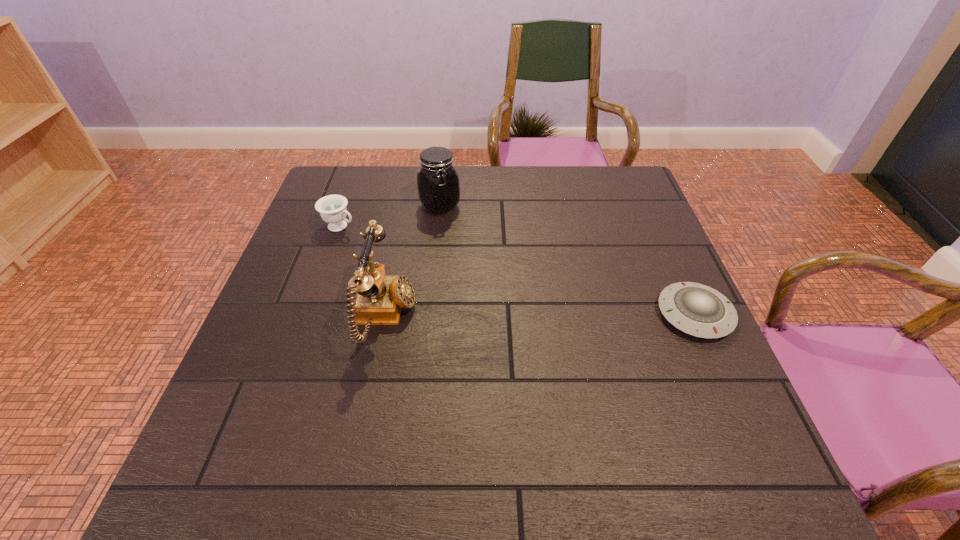
Find the location of a particular element. This screenshot has width=960, height=540. free spot between the jar and the rightmost object is located at coordinates (567, 260).

Locate an element on the screen. vacant space that's between the telephone and the jar is located at coordinates (413, 261).

Find the location of a particular element. This screenshot has width=960, height=540. vacant space that is in between the rightmost object and the leftmost object is located at coordinates (517, 270).

Where is `object that is the second nearest to the telephone`? object that is the second nearest to the telephone is located at coordinates (438, 185).

The image size is (960, 540). In order to click on object that stands as the second closest to the telephone in this screenshot , I will do `click(438, 185)`.

In order to click on free space that satisfies the following two spatial constraints: 1. on the front side of the teacup; 2. on the right side of the rightmost object in this screenshot , I will do `click(309, 314)`.

The height and width of the screenshot is (540, 960). What are the coordinates of `free point that satisfies the following two spatial constraints: 1. on the front side of the rightmost object; 2. on the left side of the teacup` in the screenshot? It's located at (309, 314).